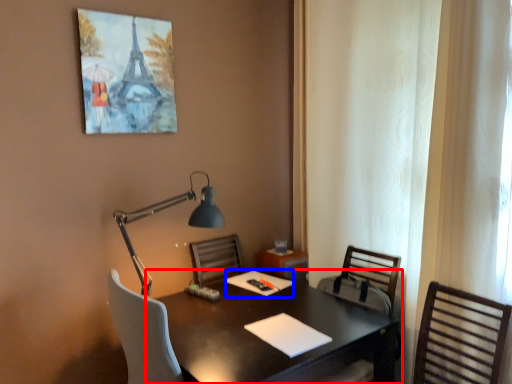
Question: Which of the following is the closest to the observer, desk (highlighted by a red box) or notepad (highlighted by a blue box)?

Choices:
 (A) desk
 (B) notepad

Answer: (A)